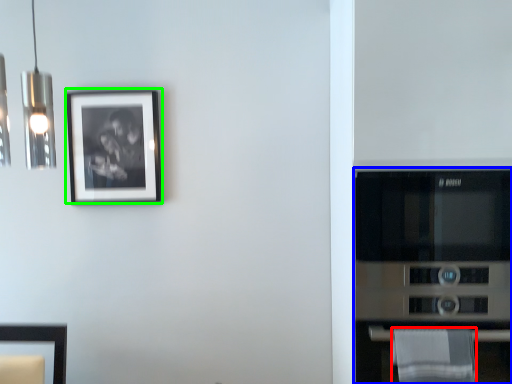
Question: Estimate the real-world distances between objects in this image. Which object is closer to cloth (highlighted by a red box), appliance (highlighted by a blue box) or picture frame (highlighted by a green box)?

Choices:
 (A) appliance
 (B) picture frame

Answer: (A)